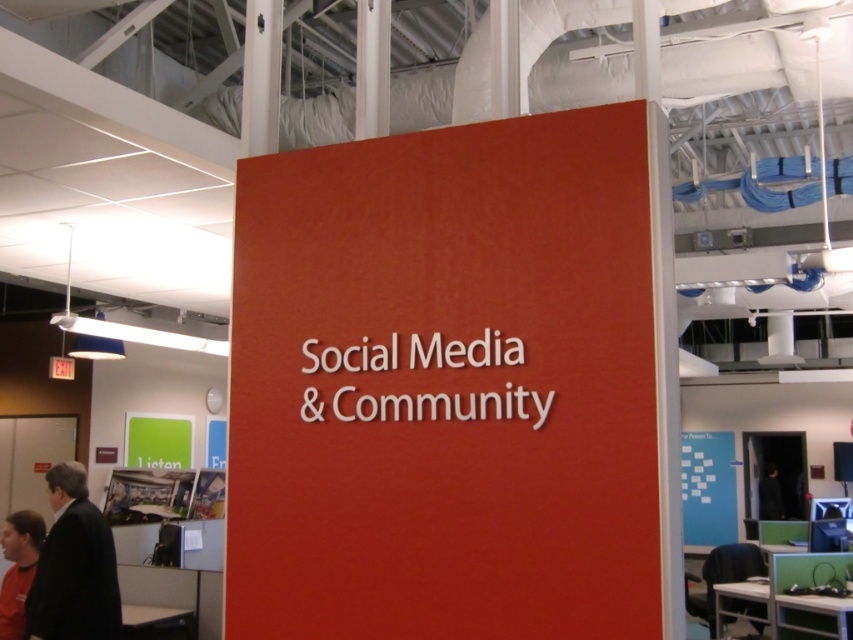
Question: Based on their relative distances, which object is nearer to the dark suit at lower left?

Choices:
 (A) black fabric at center
 (B) matte red sign at center

Answer: (B)

Question: Can you confirm if matte red sign at center is bigger than black fabric at center?

Choices:
 (A) yes
 (B) no

Answer: (A)

Question: Is dark suit at lower left below black fabric at center?

Choices:
 (A) yes
 (B) no

Answer: (B)

Question: Based on their relative distances, which object is farther from the dark suit at lower left?

Choices:
 (A) black fabric at center
 (B) matte red sign at center

Answer: (A)

Question: Does matte red sign at center appear under dark suit at lower left?

Choices:
 (A) yes
 (B) no

Answer: (B)

Question: Estimate the real-world distances between objects in this image. Which object is farther from the dark suit at lower left?

Choices:
 (A) matte black shirt at lower left
 (B) black fabric at center

Answer: (B)